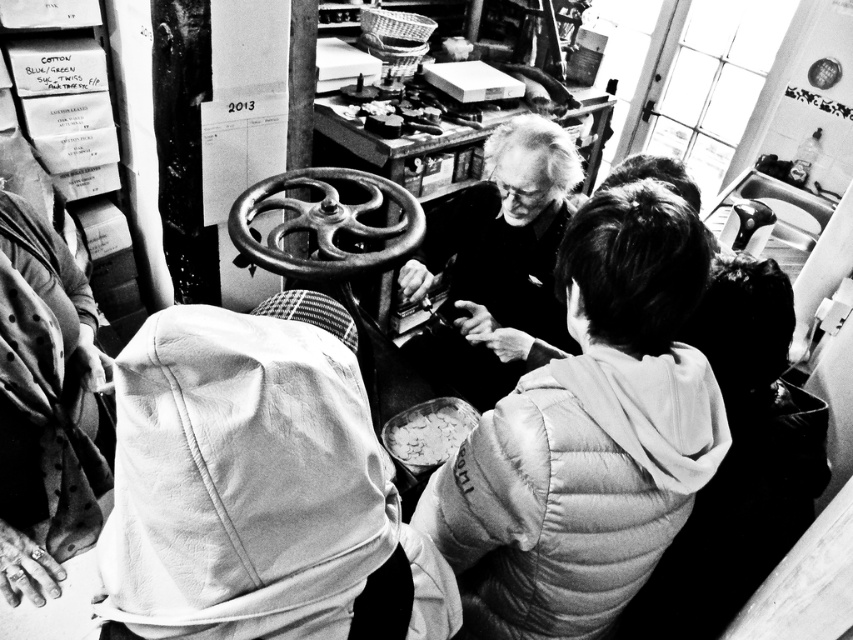
You are organizing a workshop and need to arrange seating for participants. The white puffer jacket at center and the smooth black shirt at center are part of the setup. Which clothing item takes up more space and should be considered for placement first?

The smooth black shirt at center occupies more space than the white puffer jacket at center, so it should be considered for placement first.

Based on the photo, in the scene described, there is a smooth black shirt at center and a smooth white bowl at center. Which object is bigger in size?

The smooth black shirt at center is larger in size compared to the smooth white bowl at center.